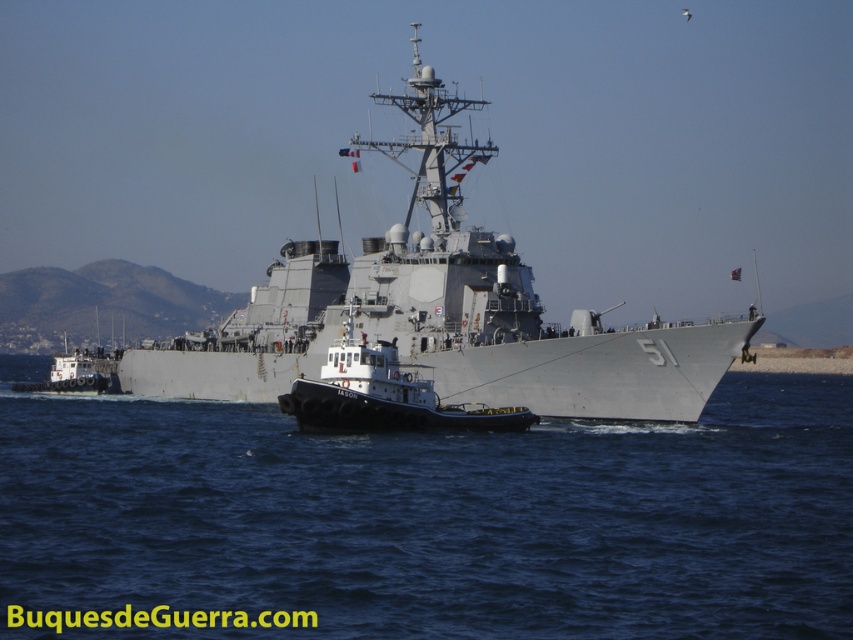
Question: Which point is closer to the camera taking this photo?

Choices:
 (A) (233, 332)
 (B) (360, 428)
 (C) (627, 532)

Answer: (C)

Question: Which object is farther from the camera taking this photo?

Choices:
 (A) gray water at center
 (B) black rubber tugboat at center
 (C) gray metallic warship at center

Answer: (C)

Question: From the image, what is the correct spatial relationship of gray water at center in relation to black rubber tugboat at center?

Choices:
 (A) left
 (B) right

Answer: (A)

Question: Which of the following is the closest to the observer?

Choices:
 (A) (416, 417)
 (B) (374, 440)
 (C) (260, 349)

Answer: (A)

Question: Is gray metallic warship at center above black rubber tugboat at center?

Choices:
 (A) yes
 (B) no

Answer: (A)

Question: Can you confirm if gray water at center is thinner than black rubber tugboat at center?

Choices:
 (A) yes
 (B) no

Answer: (B)